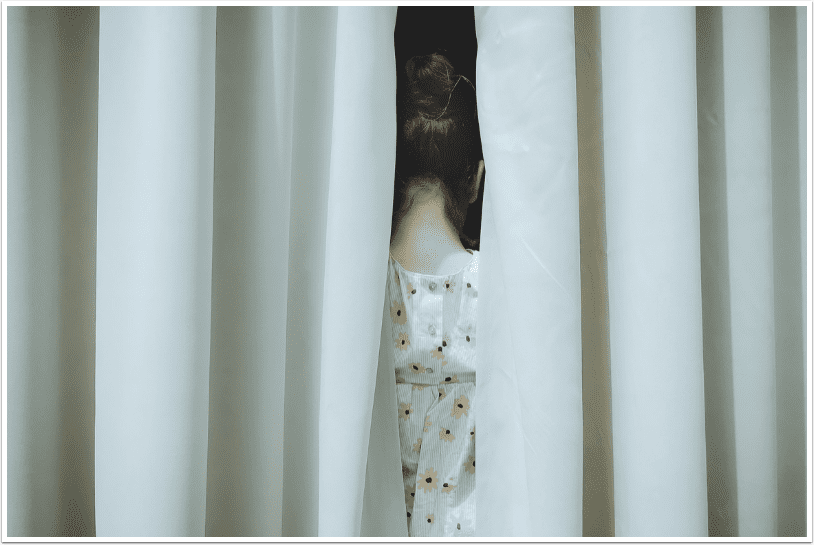
This screenshot has height=545, width=814. Identify the location of diagonal wrinkle on curtain. click(541, 263).